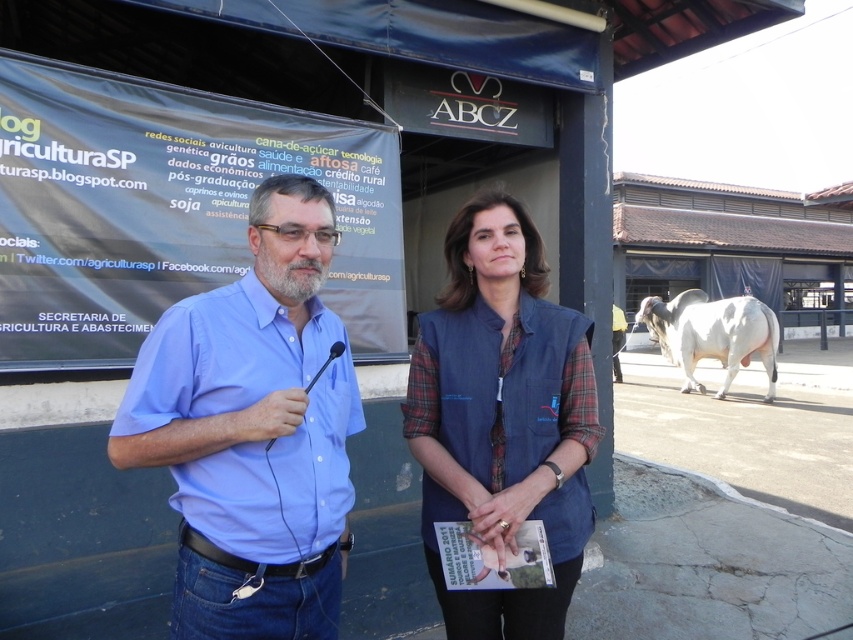
Who is shorter, blue shirt at left or denim vest at center?

blue shirt at left is shorter.

Is blue shirt at left above denim vest at center?

Indeed, blue shirt at left is positioned over denim vest at center.

Between point (184, 436) and point (532, 608), which one is positioned in front?

Point (184, 436)

Find the location of a particular element. This screenshot has height=640, width=853. blue shirt at left is located at coordinates [253, 432].

Between point (554, 374) and point (664, 308), which one is positioned in front?

Point (554, 374) is in front.

Consider the image. Can you confirm if denim vest at center is positioned above white smooth bull at right?

Yes.

Describe the element at coordinates (502, 417) in the screenshot. Image resolution: width=853 pixels, height=640 pixels. I see `denim vest at center` at that location.

The height and width of the screenshot is (640, 853). I want to click on denim vest at center, so 502,417.

Between blue shirt at left and white smooth bull at right, which one is positioned higher?

blue shirt at left

Is blue shirt at left to the right of white smooth bull at right from the viewer's perspective?

In fact, blue shirt at left is to the left of white smooth bull at right.

You are a GUI agent. You are given a task and a screenshot of the screen. Output one action in this format:
    pyautogui.click(x=<x>, y=<y>)
    Task: Click on the blue shirt at left
    The width and height of the screenshot is (853, 640).
    Given the screenshot: What is the action you would take?
    click(253, 432)